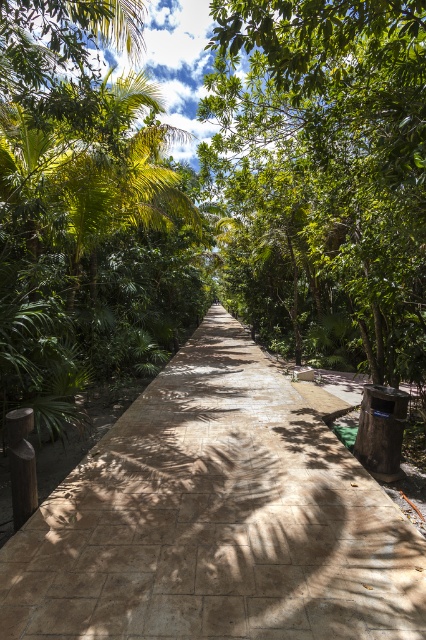
Question: Which point is farther to the camera?

Choices:
 (A) brown stone pavement at center
 (B) green leafy tree at center

Answer: (B)

Question: Does brown stone pavement at center appear on the left side of green leafy tree at center?

Choices:
 (A) yes
 (B) no

Answer: (A)

Question: Among these points, which one is farthest from the camera?

Choices:
 (A) (252, 387)
 (B) (319, 330)

Answer: (B)

Question: Which point appears closest to the camera in this image?

Choices:
 (A) (371, 156)
 (B) (74, 541)

Answer: (B)

Question: Does brown stone pavement at center appear on the right side of green leafy tree at center?

Choices:
 (A) no
 (B) yes

Answer: (A)

Question: Can you confirm if brown stone pavement at center is smaller than green leafy tree at center?

Choices:
 (A) no
 (B) yes

Answer: (B)